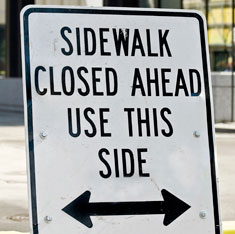
Identify the location of white painted screw. (43, 134), (49, 219), (203, 213), (199, 133).